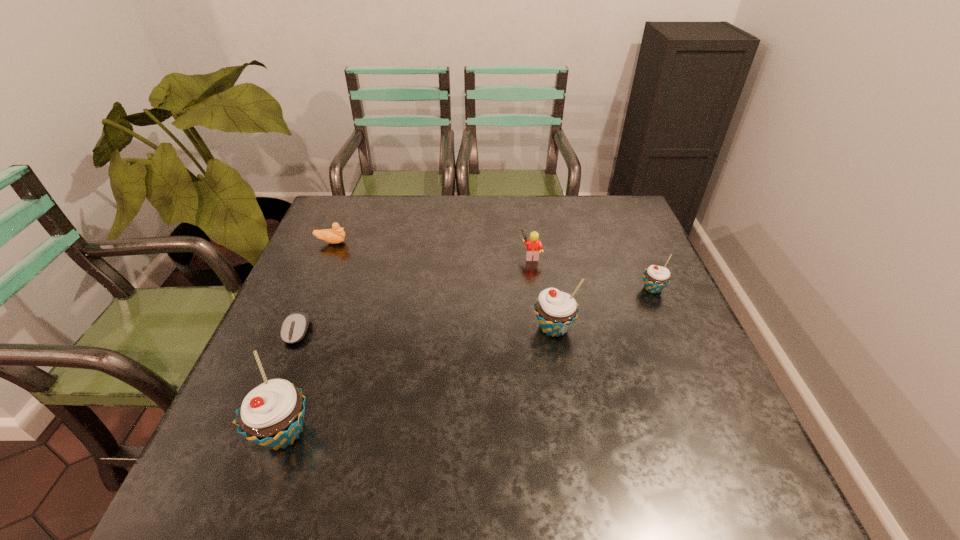
The height and width of the screenshot is (540, 960). I want to click on free space located on the back of the nearest object, so click(339, 278).

Identify the location of vacant space located on the right of the second tallest cupcake. Image resolution: width=960 pixels, height=540 pixels. (609, 327).

In order to click on vacant region located 0.100m on the back of the rightmost cupcake in this screenshot , I will do `click(638, 256)`.

Find the location of a particular element. This screenshot has height=540, width=960. vacant space located on the face of the farthest object is located at coordinates (472, 242).

Identify the location of vacant space located in front of the Lego with the accessory visible. The height and width of the screenshot is (540, 960). (483, 255).

Identify the location of free space located in front of the Lego with the accessory visible. The height and width of the screenshot is (540, 960). (405, 255).

At what (x,y) coordinates should I click in order to perform the action: click on vacant area situated 0.100m in front of the Lego with the accessory visible. Please return your answer as a coordinate pair (x, y). The height and width of the screenshot is (540, 960). Looking at the image, I should click on (486, 255).

Locate an element on the screen. vacant space situated 0.190m on the wheel side of the computer equipment is located at coordinates (260, 421).

Locate an element on the screen. object at the near edge is located at coordinates (271, 415).

I want to click on cupcake that is at the left edge, so click(271, 415).